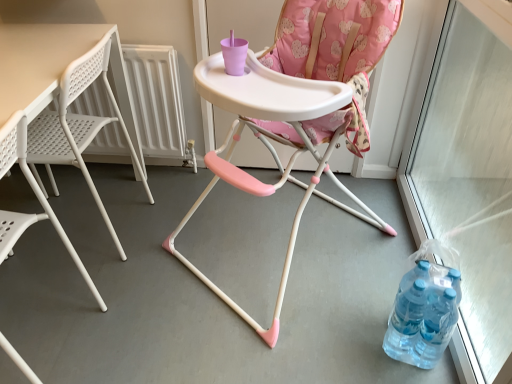
This screenshot has height=384, width=512. Find the location of `vacant space behind white plastic chair at left, the second chair when ordered from right to left`. vacant space behind white plastic chair at left, the second chair when ordered from right to left is located at coordinates (77, 276).